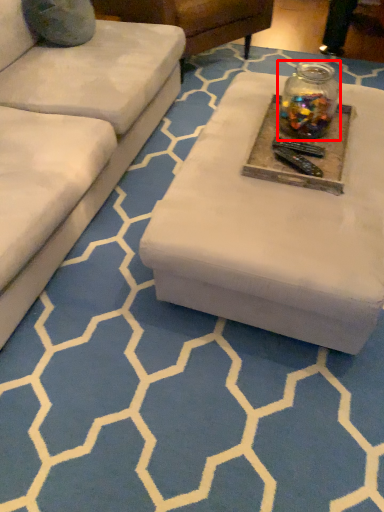
Question: From the image's perspective, considering the relative positions of glass jar (annotated by the red box) and round table in the image provided, where is glass jar (annotated by the red box) located with respect to the staircase?

Choices:
 (A) above
 (B) below

Answer: (A)